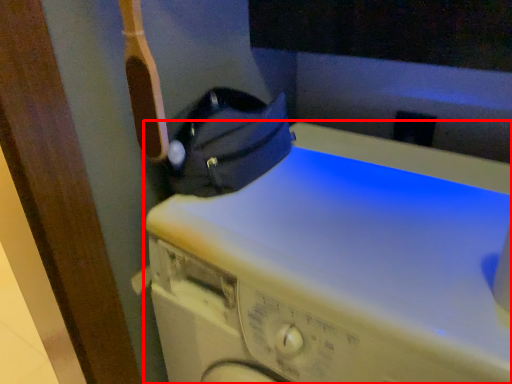
Question: Observing the image, what is the correct spatial positioning of washing machine (annotated by the red box) in reference to bag?

Choices:
 (A) left
 (B) right

Answer: (B)